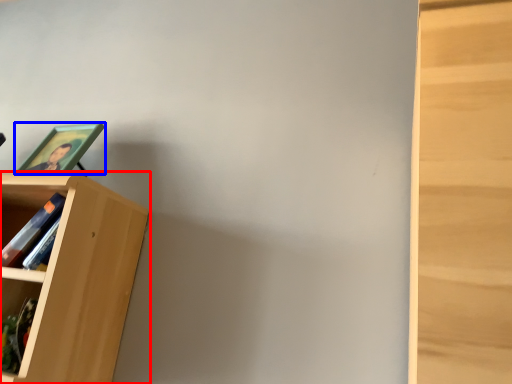
Question: Which object appears closest to the camera in this image, bookcase (highlighted by a red box) or picture frame (highlighted by a blue box)?

Choices:
 (A) bookcase
 (B) picture frame

Answer: (A)